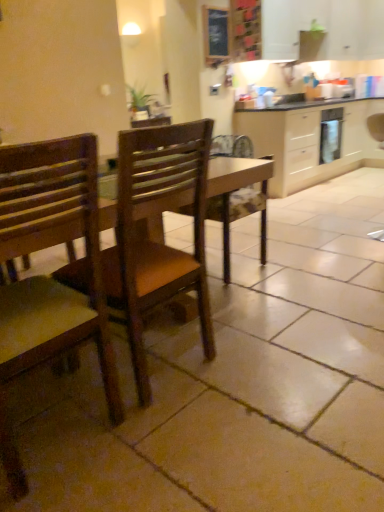
Where is `vacant space to the right of wooden chair at center, which is the 1th chair in right-to-left order`? The height and width of the screenshot is (512, 384). vacant space to the right of wooden chair at center, which is the 1th chair in right-to-left order is located at coordinates (249, 361).